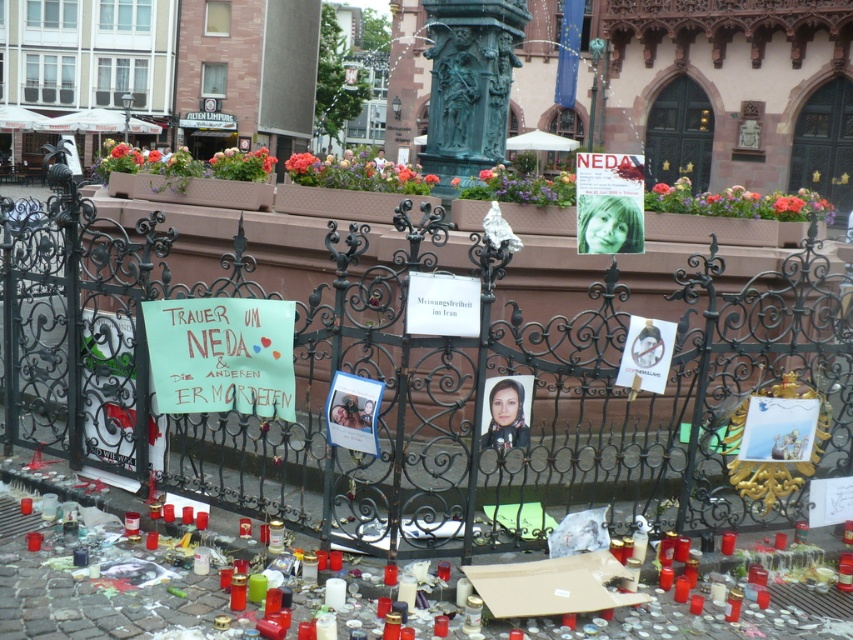
Question: Which object is the farthest from the black wrought iron fence at center?

Choices:
 (A) green patinated bronze statue at center
 (B) matte paper poster at center

Answer: (A)

Question: Can you confirm if green patinated bronze statue at center is thinner than matte paper poster at center?

Choices:
 (A) no
 (B) yes

Answer: (A)

Question: Among these points, which one is farthest from the camera?

Choices:
 (A) (358, 442)
 (B) (96, 368)

Answer: (B)

Question: Is black wrought iron fence at center wider than matte paper photo frame at center?

Choices:
 (A) no
 (B) yes

Answer: (B)

Question: Estimate the real-world distances between objects in this image. Which object is closer to the matte paper poster at center?

Choices:
 (A) black wrought iron fence at center
 (B) matte paper photo frame at center

Answer: (B)

Question: Does black wrought iron fence at center appear over green patinated bronze statue at center?

Choices:
 (A) no
 (B) yes

Answer: (A)